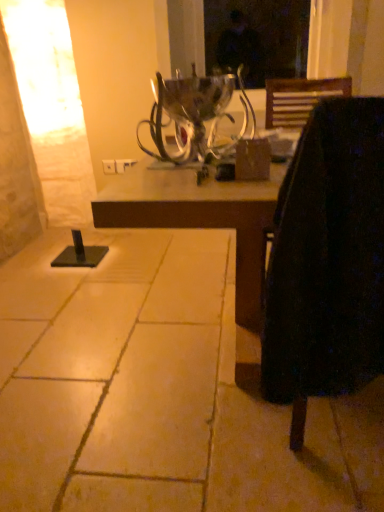
Where is `free spot above brown tile floor at lower left (from a real-world perspective)`? The width and height of the screenshot is (384, 512). free spot above brown tile floor at lower left (from a real-world perspective) is located at coordinates (140, 307).